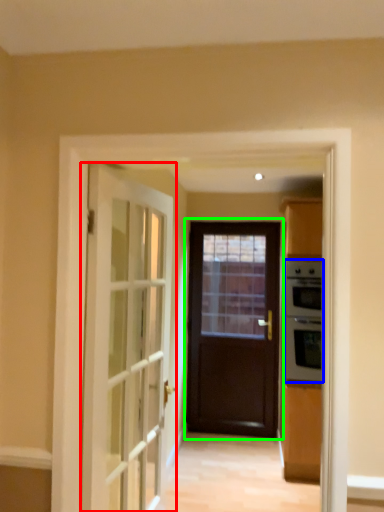
Question: Which is farther away from door (highlighted by a red box)? appliance (highlighted by a blue box) or door (highlighted by a green box)?

Choices:
 (A) appliance
 (B) door

Answer: (B)